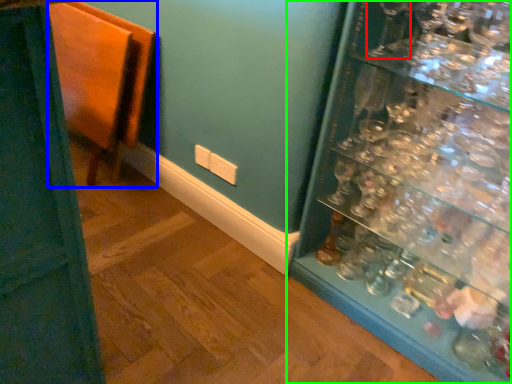
Question: Which object is the closest to the wine glass (highlighted by a red box)? Choose among these: furniture (highlighted by a blue box) or shelf (highlighted by a green box).

Choices:
 (A) furniture
 (B) shelf

Answer: (B)